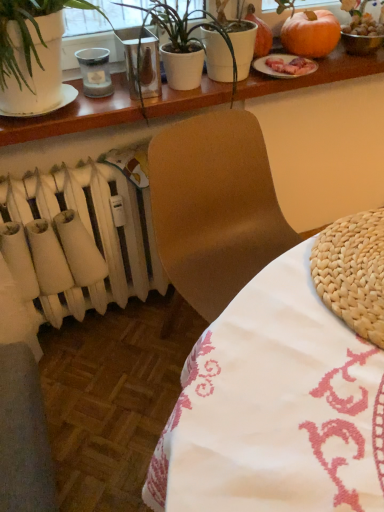
Question: Based on their positions, is white matte radiator at lower left located to the left or right of metallic glass vase at upper center?

Choices:
 (A) left
 (B) right

Answer: (A)

Question: From a real-world perspective, is white matte radiator at lower left physically located above or below metallic glass vase at upper center?

Choices:
 (A) below
 (B) above

Answer: (A)

Question: Considering the real-world distances, which object is farthest from the white matte radiator at lower left?

Choices:
 (A) white woven placemat at lower left, arranged as the second table when viewed from the top
 (B) white ceramic plate at upper right
 (C) orange matte pumpkin at upper right
 (D) white glossy table at upper center, the 2th table positioned from the bottom
 (E) metallic glass vase at upper center

Answer: (C)

Question: Which of these objects is positioned farthest from the white glossy table at upper center, the 2th table positioned from the bottom?

Choices:
 (A) white ceramic plate at upper right
 (B) white matte pot at upper center
 (C) white matte radiator at lower left
 (D) white woven placemat at lower left, which ranks as the 1th table in bottom-to-top order
 (E) metallic glass vase at upper center

Answer: (D)